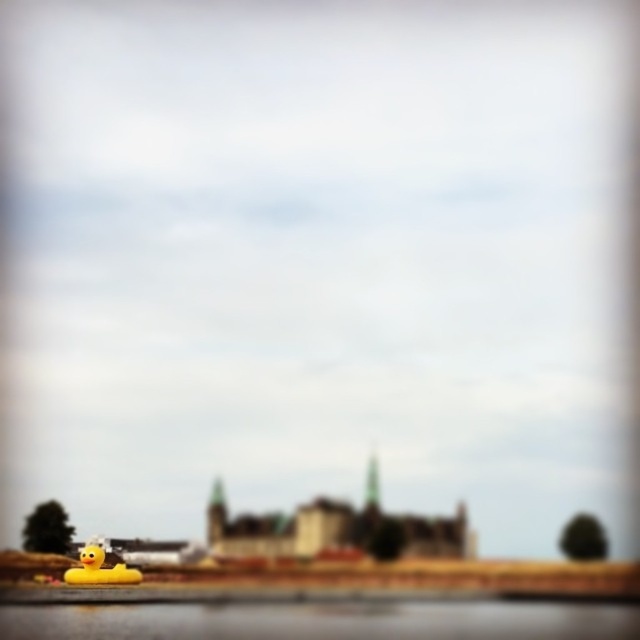
Question: In this image, where is transparent plastic water at lower left located relative to yellow rubber duck at lower left?

Choices:
 (A) below
 (B) above

Answer: (A)

Question: Which of the following is the farthest from the observer?

Choices:
 (A) (140, 572)
 (B) (568, 620)

Answer: (A)

Question: Can you confirm if transparent plastic water at lower left is positioned below yellow rubber duck at lower left?

Choices:
 (A) yes
 (B) no

Answer: (A)

Question: Considering the relative positions of transparent plastic water at lower left and yellow rubber duck at lower left in the image provided, where is transparent plastic water at lower left located with respect to yellow rubber duck at lower left?

Choices:
 (A) right
 (B) left

Answer: (A)

Question: Which object appears farthest from the camera in this image?

Choices:
 (A) yellow rubber duck at lower left
 (B) transparent plastic water at lower left

Answer: (A)